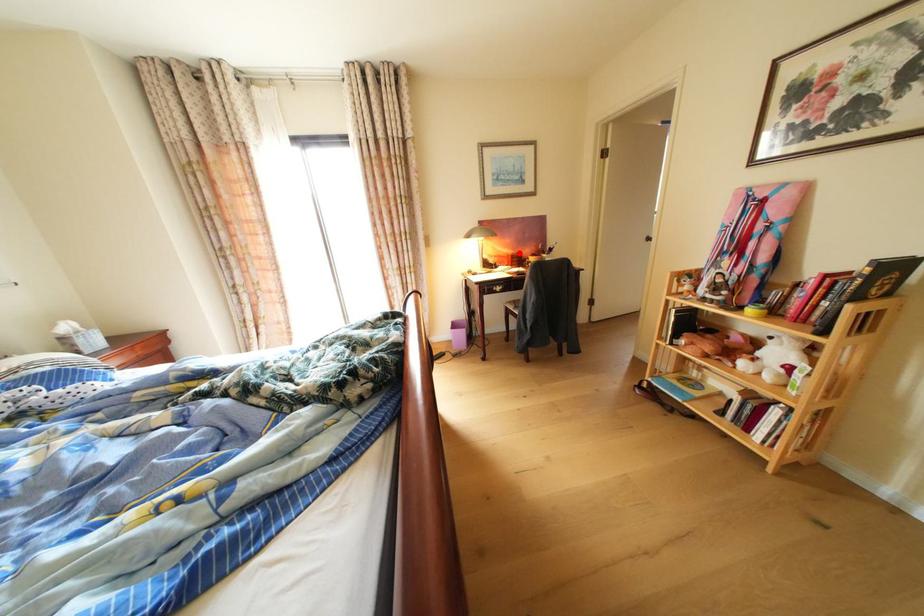
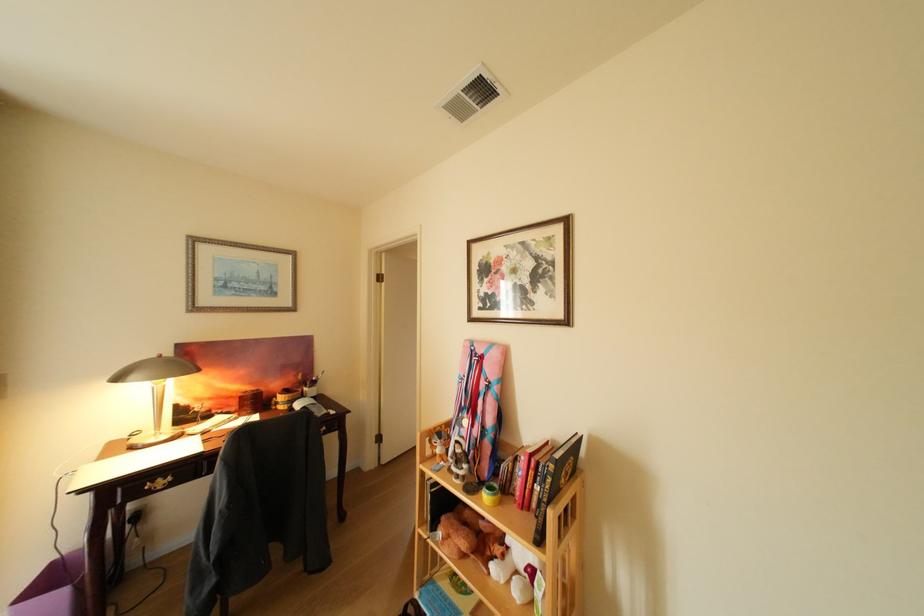
Find the pixel in the second image that matches the highlighted location in the first image.

(251, 389)